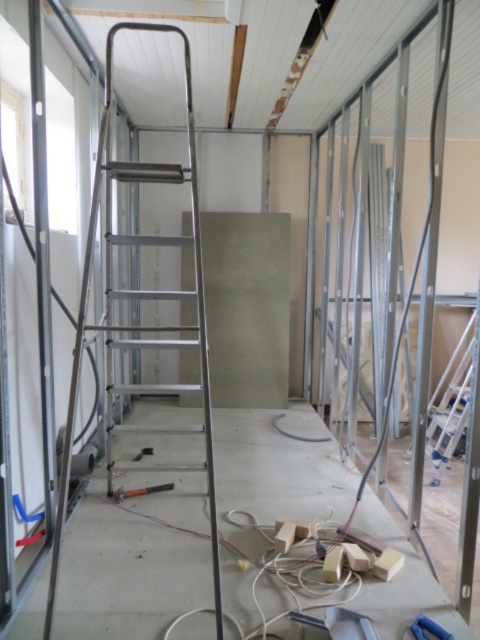
You are a construction worker who needs to choose between the silver metallic ladder at left and the black rubber hammer at center for a task requiring a larger tool. Which object should you select?

The silver metallic ladder at left is bigger than the black rubber hammer at center, so you should select the silver metallic ladder at left for the task requiring a larger tool.

You are a construction worker standing at the entrance of the room. You need to reach the exposed metal framing near the ceiling to install a support beam. The ladder you have is the silver metallic ladder at left. Based on its position, can you safely place this ladder to reach the framing?

The silver metallic ladder at left is positioned at point (139,298), which is close enough to the exposed metal framing near the ceiling to safely place the ladder and reach the area for installing the support beam.

You are a construction worker who needs to move the silver metallic ladder at left and the black rubber hammer at center to a storage area. The storage area has a narrow doorway that can only accommodate items up to 1 meter in width. Based on their sizes, which item might not fit through the doorway?

The silver metallic ladder at left has a larger width than the black rubber hammer at center, so the silver metallic ladder at left might not fit through the doorway.